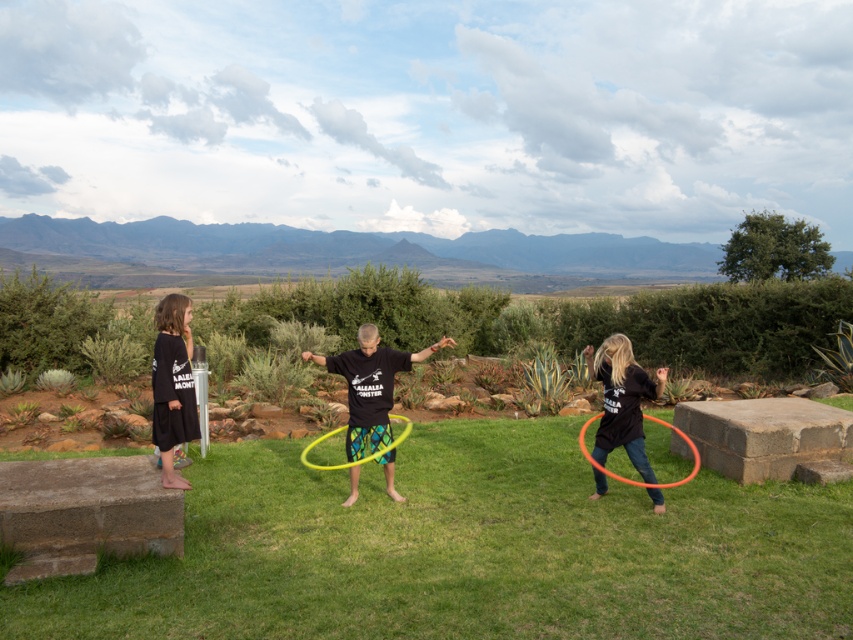
Question: Among these objects, which one is nearest to the camera?

Choices:
 (A) yellow plastic hula hoop at center
 (B) black cotton shirt at left

Answer: (B)

Question: Can you confirm if matte black t-shirt at center is positioned to the left of yellow plastic hula hoop at center?

Choices:
 (A) yes
 (B) no

Answer: (B)

Question: Which object is closer to the camera taking this photo?

Choices:
 (A) matte black t-shirt at center
 (B) black matte hula hoop at lower right

Answer: (B)

Question: Does black matte hula hoop at lower right come in front of black cotton shirt at left?

Choices:
 (A) no
 (B) yes

Answer: (A)

Question: Does matte black t-shirt at center have a lesser width compared to yellow plastic hula hoop at center?

Choices:
 (A) yes
 (B) no

Answer: (A)

Question: Which object appears closest to the camera in this image?

Choices:
 (A) matte black t-shirt at center
 (B) orange plastic hula hoop at lower right

Answer: (B)